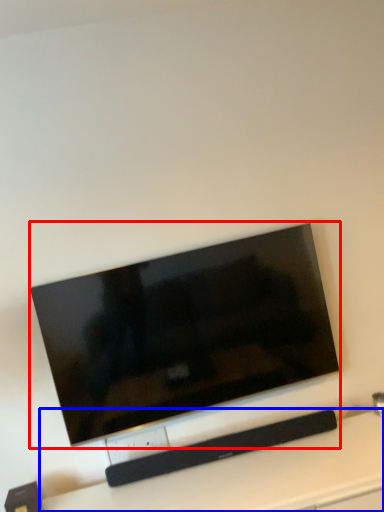
Question: Which point is closer to the camera, television (highlighted by a red box) or furniture (highlighted by a blue box)?

Choices:
 (A) television
 (B) furniture

Answer: (B)